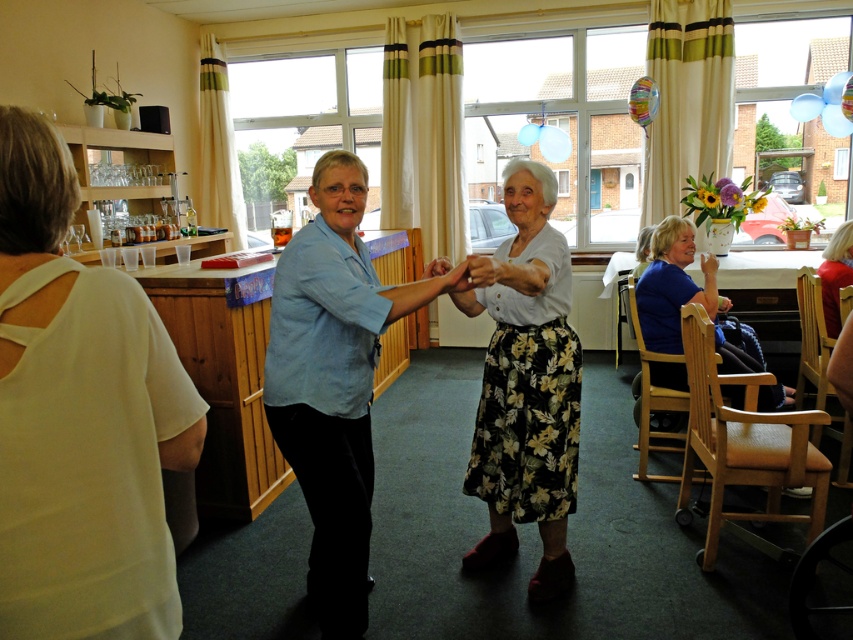
Which is in front, point (567, 428) or point (680, 246)?

Point (567, 428) is more forward.

Is floral cotton skirt at center closer to the viewer compared to blue fabric chair at lower right?

Yes, it is.

Does point (525, 220) come behind point (730, 352)?

No.

Image resolution: width=853 pixels, height=640 pixels. Identify the location of floral cotton skirt at center. (526, 385).

Is the position of white cotton shirt at left more distant than that of blue fabric chair at lower right?

No, white cotton shirt at left is in front of blue fabric chair at lower right.

Can you confirm if white cotton shirt at left is wider than blue fabric chair at lower right?

Incorrect, white cotton shirt at left's width does not surpass blue fabric chair at lower right's.

Between point (109, 413) and point (706, 264), which one is positioned in front?

Point (109, 413) is more forward.

I want to click on white cotton shirt at left, so click(x=80, y=419).

Based on the photo, is floral cotton skirt at center below blonde hair at right?

Yes, floral cotton skirt at center is below blonde hair at right.

Is point (508, 212) positioned after point (838, 237)?

No, it is not.

At what (x,y) coordinates should I click in order to perform the action: click on floral cotton skirt at center. Please return your answer as a coordinate pair (x, y). Image resolution: width=853 pixels, height=640 pixels. Looking at the image, I should click on (526, 385).